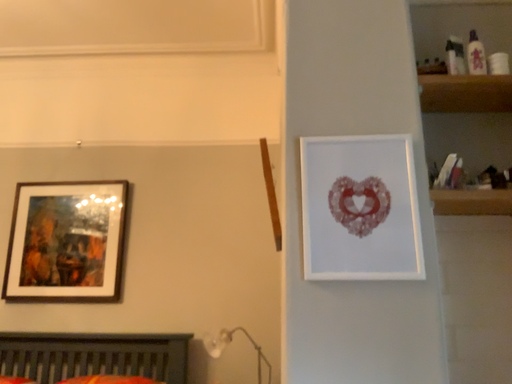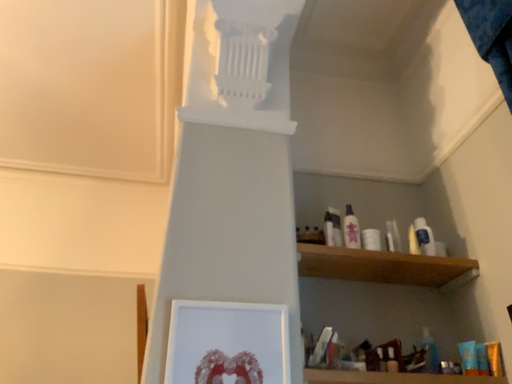
Question: Which way did the camera rotate in the video?

Choices:
 (A) rotated right
 (B) rotated left

Answer: (A)